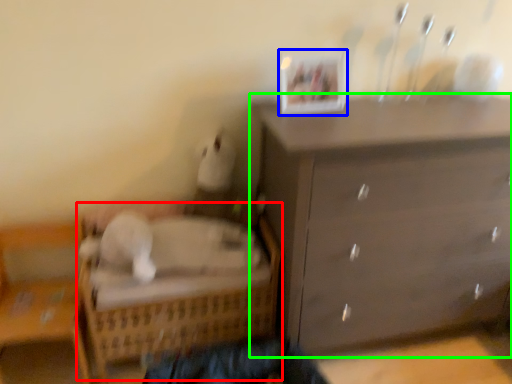
Question: Which object is the farthest from bed (highlighted by a red box)? Choose among these: picture frame (highlighted by a blue box) or chest of drawers (highlighted by a green box).

Choices:
 (A) picture frame
 (B) chest of drawers

Answer: (A)